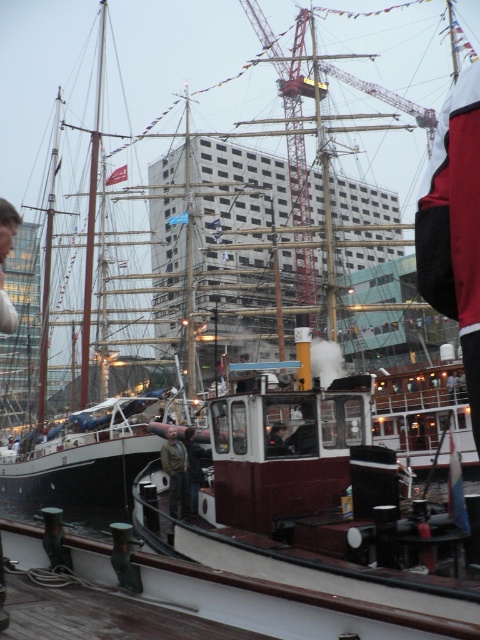
Question: Which point is farther to the camera?

Choices:
 (A) brown leather jacket at center
 (B) dark blue jeans at center
 (C) dark brown leather jacket at center

Answer: (B)

Question: Which of these objects is positioned closest to the brown leather jacket at center?

Choices:
 (A) dark brown leather jacket at center
 (B) dark blue jeans at center

Answer: (B)

Question: Which point is farther to the camera?

Choices:
 (A) brown leather jacket at center
 (B) dark brown leather jacket at center
 (C) dark blue jeans at center

Answer: (C)

Question: Can you confirm if brown leather jacket at center is bigger than dark brown leather jacket at center?

Choices:
 (A) no
 (B) yes

Answer: (B)

Question: Can you confirm if dark blue jeans at center is bigger than dark brown leather jacket at center?

Choices:
 (A) no
 (B) yes

Answer: (A)

Question: Does dark blue jeans at center have a larger size compared to dark brown leather jacket at center?

Choices:
 (A) yes
 (B) no

Answer: (B)